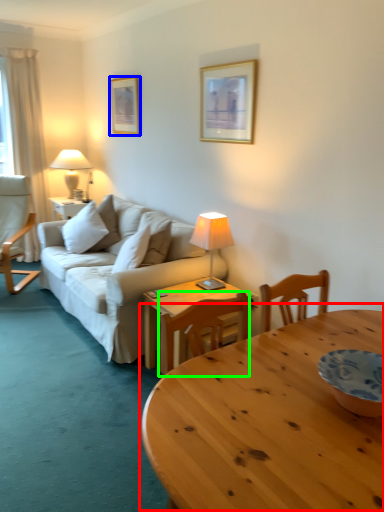
Question: Which is farther away from coffee table (highlighted by a red box)? picture frame (highlighted by a blue box) or chair (highlighted by a green box)?

Choices:
 (A) picture frame
 (B) chair

Answer: (A)